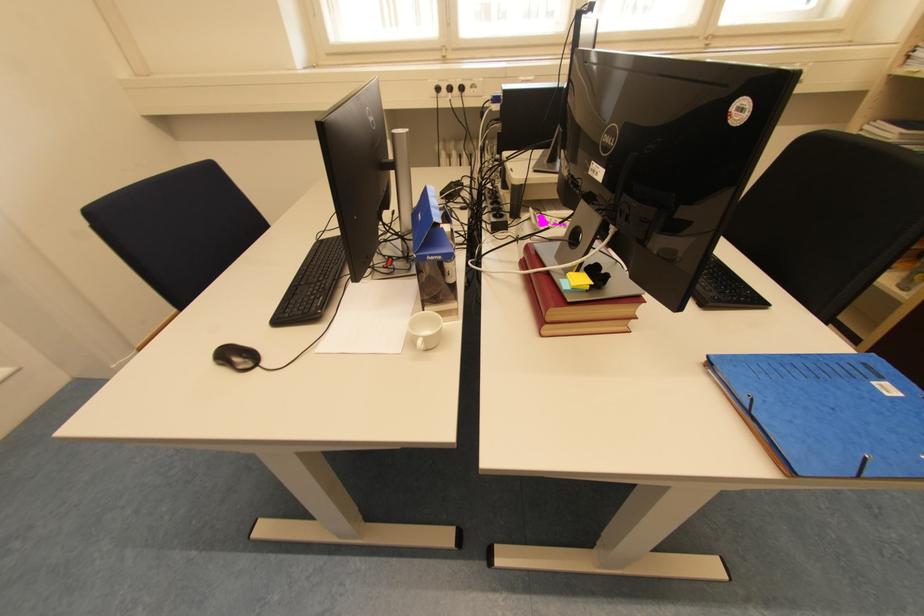
Locate an element on the screen. This screenshot has width=924, height=616. white ceramic cup is located at coordinates (424, 330).